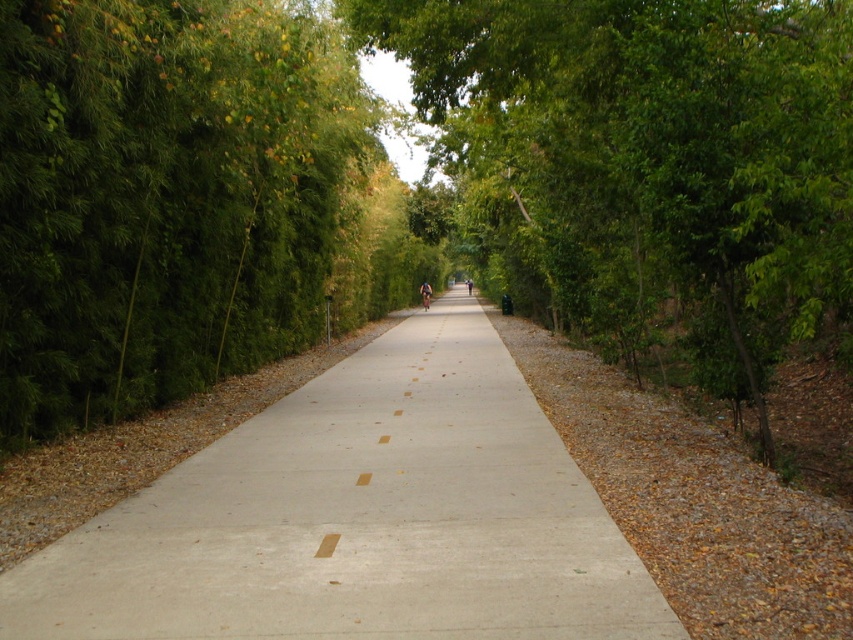
You are standing at the starting point of the pathway and see two points marked on the path. The first point is at coordinate point (844,38) and the second is at point (467,292). Which point is closer to your current position?

Answer: Point (844,38) is in front of point (467,292), so the first point is closer to your current position.